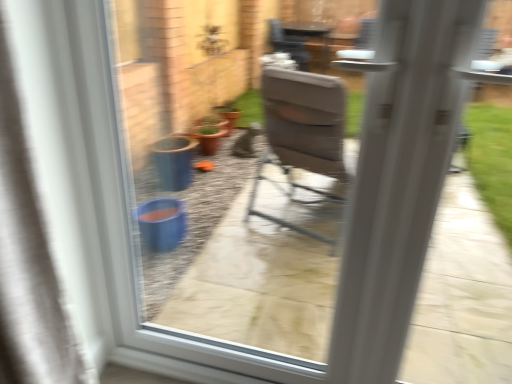
Describe the element at coordinates (30, 245) in the screenshot. This screenshot has width=512, height=384. I see `white fabric curtain at left` at that location.

Where is `white fabric curtain at left`? Image resolution: width=512 pixels, height=384 pixels. white fabric curtain at left is located at coordinates (30, 245).

Locate an element on the screen. white fabric curtain at left is located at coordinates (30, 245).